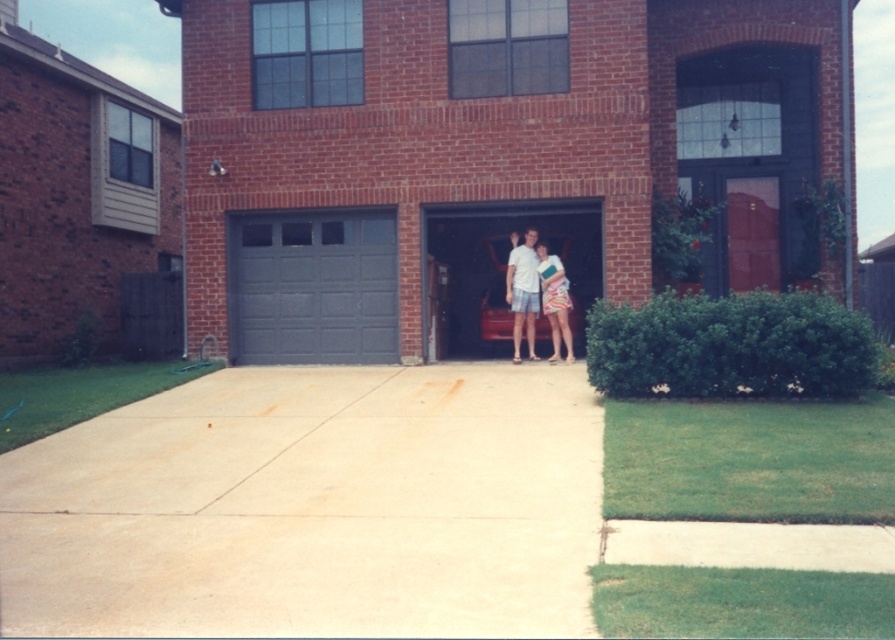
Question: Is gray matte garage door at left to the left of striped fabric dress at center from the viewer's perspective?

Choices:
 (A) yes
 (B) no

Answer: (A)

Question: Can you confirm if beige concrete driveway at center is positioned above white cotton shirt at center?

Choices:
 (A) no
 (B) yes

Answer: (A)

Question: Can you confirm if beige concrete driveway at center is positioned to the left of white cotton shirt at center?

Choices:
 (A) no
 (B) yes

Answer: (B)

Question: Which point is closer to the camera?

Choices:
 (A) (239, 355)
 (B) (458, 250)

Answer: (A)

Question: Among these points, which one is nearest to the camera?

Choices:
 (A) (542, 244)
 (B) (183, 532)

Answer: (B)

Question: Estimate the real-world distances between objects in this image. Which object is closer to the gray matte garage door at left?

Choices:
 (A) matte white shorts at center
 (B) white cotton shirt at center
 (C) striped fabric dress at center
 (D) metallic gray garage door at center

Answer: (A)